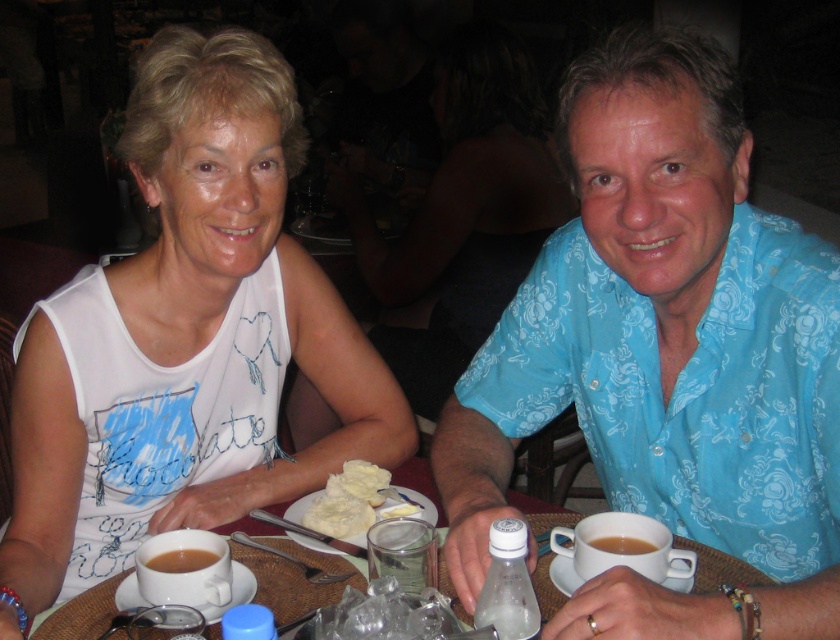
Question: Does blue floral shirt at center have a larger size compared to clear plastic bottle at lower center?

Choices:
 (A) yes
 (B) no

Answer: (A)

Question: Estimate the real-world distances between objects in this image. Which object is closer to the clear glass jar at center?

Choices:
 (A) white buttery bread at center
 (B) blue floral shirt at center

Answer: (A)

Question: Does blue floral shirt at center appear over brown matte cup at lower left?

Choices:
 (A) no
 (B) yes

Answer: (B)

Question: Which object is closer to the camera taking this photo?

Choices:
 (A) white matte tank top at center
 (B) brown matte cup at lower center
 (C) clear plastic bottle at lower center

Answer: (C)

Question: Is blue floral shirt at center smaller than brown matte cup at lower center?

Choices:
 (A) yes
 (B) no

Answer: (B)

Question: Which of the following is the farthest from the observer?

Choices:
 (A) (628, 541)
 (B) (513, 580)
 (C) (361, 516)
 (D) (686, 288)

Answer: (C)